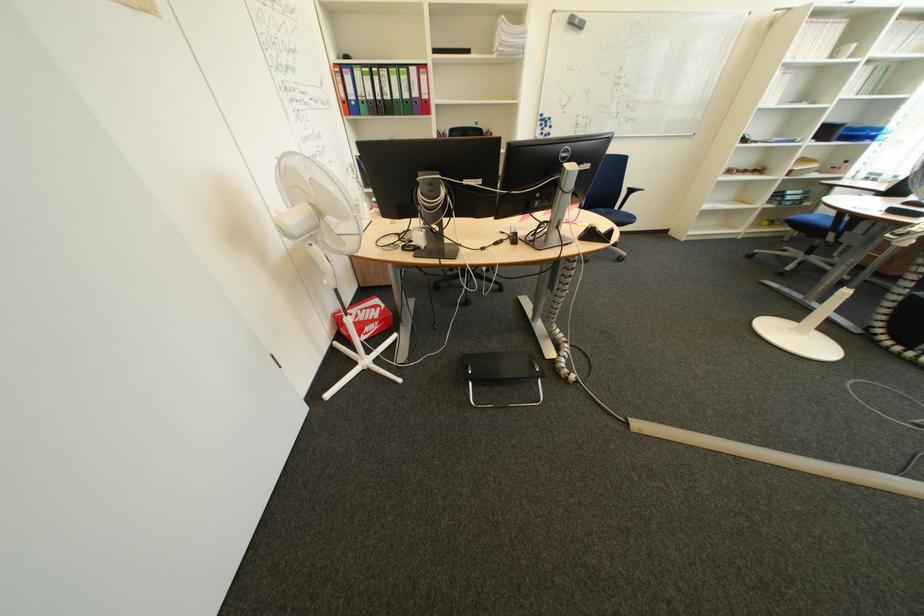
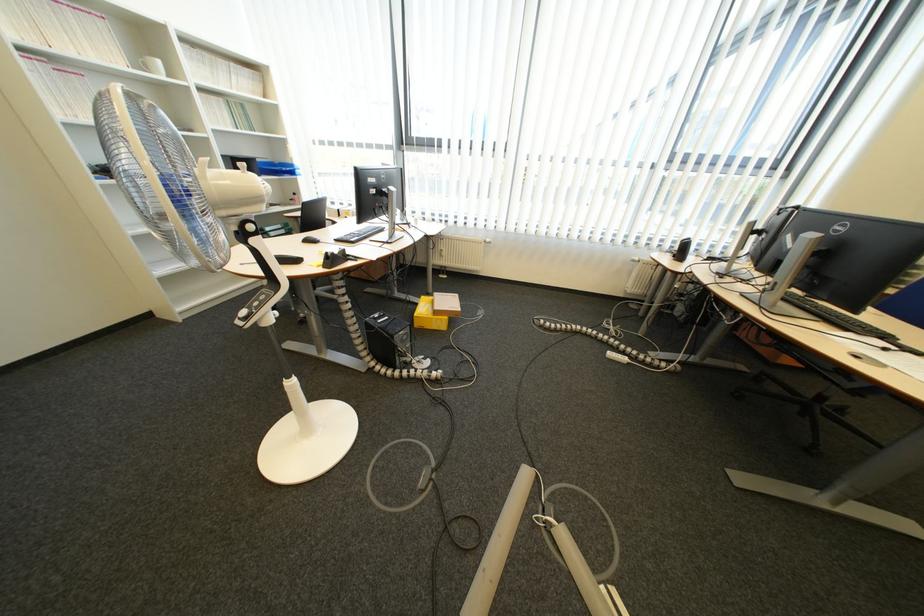
In the second image, find the point that corresponds to point 752,238 in the first image.

(277, 285)